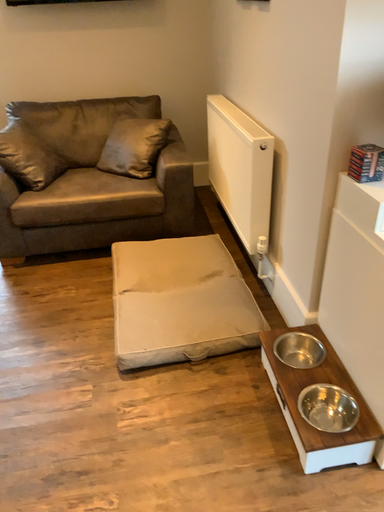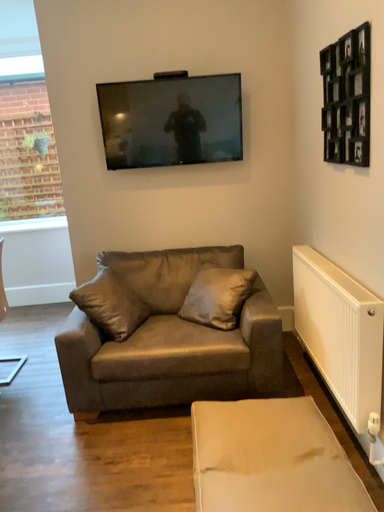
Question: Which way did the camera rotate in the video?

Choices:
 (A) rotated upward
 (B) rotated downward

Answer: (A)